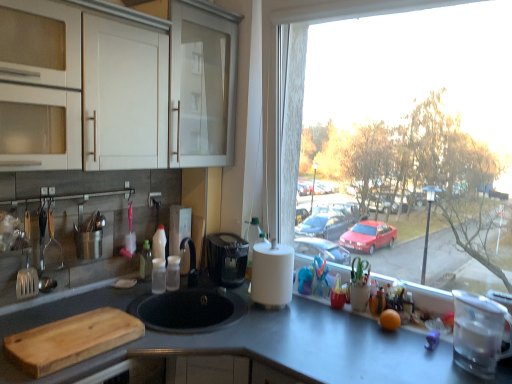
Identify the location of vacant space in transparent glass water filter at right, which is the 2th appliance in back-to-front order (from a real-world perspective). The image size is (512, 384). (470, 369).